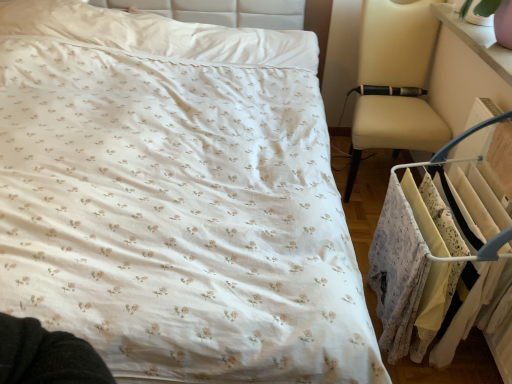
Question: Does white fabric clothes at right appear on the left side of pink glossy changing table at upper right?

Choices:
 (A) no
 (B) yes

Answer: (B)

Question: From a real-world perspective, is white fabric clothes at right over pink glossy changing table at upper right?

Choices:
 (A) no
 (B) yes

Answer: (A)

Question: Considering the relative sizes of white fabric clothes at right and pink glossy changing table at upper right in the image provided, is white fabric clothes at right thinner than pink glossy changing table at upper right?

Choices:
 (A) no
 (B) yes

Answer: (A)

Question: Does white fabric clothes at right have a larger size compared to pink glossy changing table at upper right?

Choices:
 (A) no
 (B) yes

Answer: (B)

Question: Does white fabric clothes at right appear on the right side of pink glossy changing table at upper right?

Choices:
 (A) yes
 (B) no

Answer: (B)

Question: Is white fabric clothes at right positioned with its back to pink glossy changing table at upper right?

Choices:
 (A) yes
 (B) no

Answer: (B)

Question: Considering the relative sizes of pink glossy changing table at upper right and white fabric clothes at right in the image provided, is pink glossy changing table at upper right shorter than white fabric clothes at right?

Choices:
 (A) no
 (B) yes

Answer: (B)

Question: Is pink glossy changing table at upper right at the left side of white fabric clothes at right?

Choices:
 (A) yes
 (B) no

Answer: (B)

Question: Is pink glossy changing table at upper right in contact with white fabric clothes at right?

Choices:
 (A) yes
 (B) no

Answer: (B)

Question: From the image's perspective, is pink glossy changing table at upper right located above white fabric clothes at right?

Choices:
 (A) yes
 (B) no

Answer: (A)

Question: Can you confirm if pink glossy changing table at upper right is positioned to the right of white fabric clothes at right?

Choices:
 (A) no
 (B) yes

Answer: (B)

Question: Does pink glossy changing table at upper right have a larger size compared to white fabric clothes at right?

Choices:
 (A) no
 (B) yes

Answer: (A)

Question: From the image's perspective, is white fabric clothes at right above or below pink glossy changing table at upper right?

Choices:
 (A) below
 (B) above

Answer: (A)